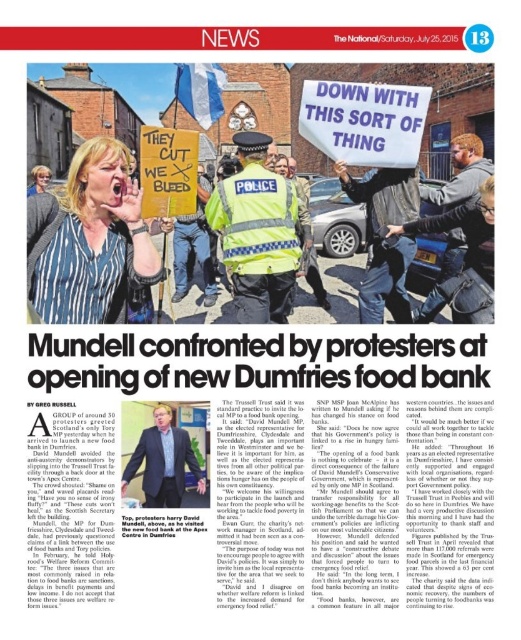
Which of these two, dark blue uniform at center or yellow safety vest at center, stands taller?

yellow safety vest at center is taller.

Does dark blue uniform at center appear over yellow safety vest at center?

No, dark blue uniform at center is not above yellow safety vest at center.

Which is behind, point (412, 212) or point (190, 275)?

Positioned behind is point (190, 275).

Locate an element on the screen. This screenshot has width=521, height=640. dark blue uniform at center is located at coordinates (383, 237).

Is point (304, 99) behind point (446, 296)?

No.

Is point (410, 148) closer to viewer compared to point (460, 218)?

No, it is not.

Where is `white fabric banner at upper center`? The width and height of the screenshot is (521, 640). white fabric banner at upper center is located at coordinates (364, 122).

Looking at this image, is blue fabric bag at center taller than formal suit at center?

Yes, blue fabric bag at center is taller than formal suit at center.

Is blue fabric bag at center further to camera compared to formal suit at center?

Yes, it is behind formal suit at center.

At what (x,y) coordinates should I click in order to perform the action: click on blue fabric bag at center. Please return your answer as a coordinate pair (x, y). Image resolution: width=521 pixels, height=640 pixels. Looking at the image, I should click on (464, 256).

Find the location of a particular element. blue fabric bag at center is located at coordinates (464, 256).